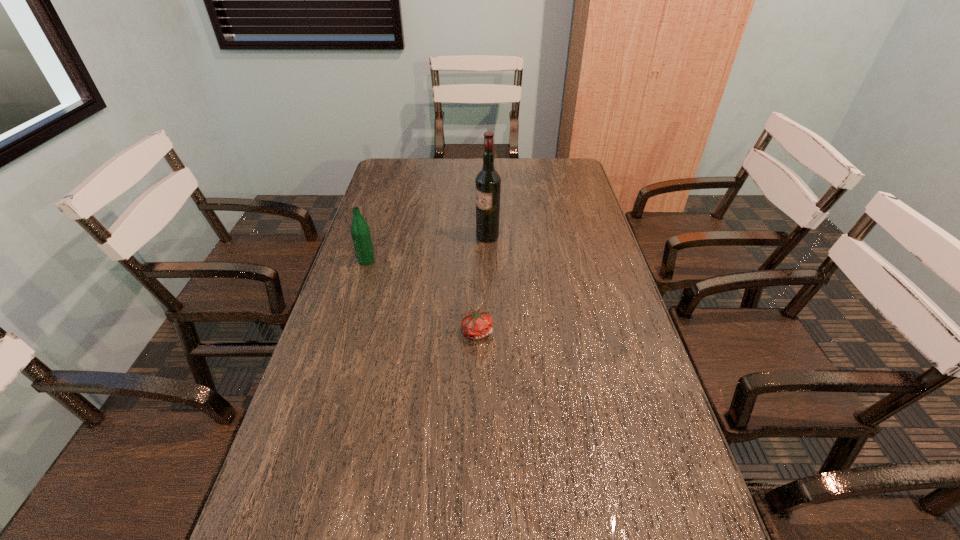
Identify the location of free spot located 0.230m on the left of the tomato. The image size is (960, 540). (375, 332).

Locate an element on the screen. The width and height of the screenshot is (960, 540). object at the left edge is located at coordinates (360, 231).

You are a GUI agent. You are given a task and a screenshot of the screen. Output one action in this format:
    pyautogui.click(x=<x>, y=<y>)
    Task: Click on the vacant space at the far edge of the desktop
    Image resolution: width=960 pixels, height=540 pixels.
    Given the screenshot: What is the action you would take?
    pyautogui.click(x=482, y=164)

You are a GUI agent. You are given a task and a screenshot of the screen. Output one action in this format:
    pyautogui.click(x=<x>, y=<y>)
    Task: Click on the free space at the left edge of the desktop
    Image resolution: width=960 pixels, height=540 pixels.
    Given the screenshot: What is the action you would take?
    pyautogui.click(x=318, y=396)

At what (x,y) coordinates should I click in order to perform the action: click on blank space at the right edge. Please return your answer as a coordinate pair (x, y). Looking at the image, I should click on pos(626,431).

Find the location of a particular element. The image size is (960, 540). free space between the shortest object and the wine bottle is located at coordinates (482, 284).

Find the location of a particular element. free space between the wine bottle and the shortest object is located at coordinates (482, 284).

Locate an element on the screen. The image size is (960, 540). blank region between the nearest object and the wine bottle is located at coordinates (482, 284).

Locate an element on the screen. The width and height of the screenshot is (960, 540). free space between the leftmost object and the wine bottle is located at coordinates pos(427,248).

Where is `vacant region between the wine bottle and the shortest object`? vacant region between the wine bottle and the shortest object is located at coordinates (482, 284).